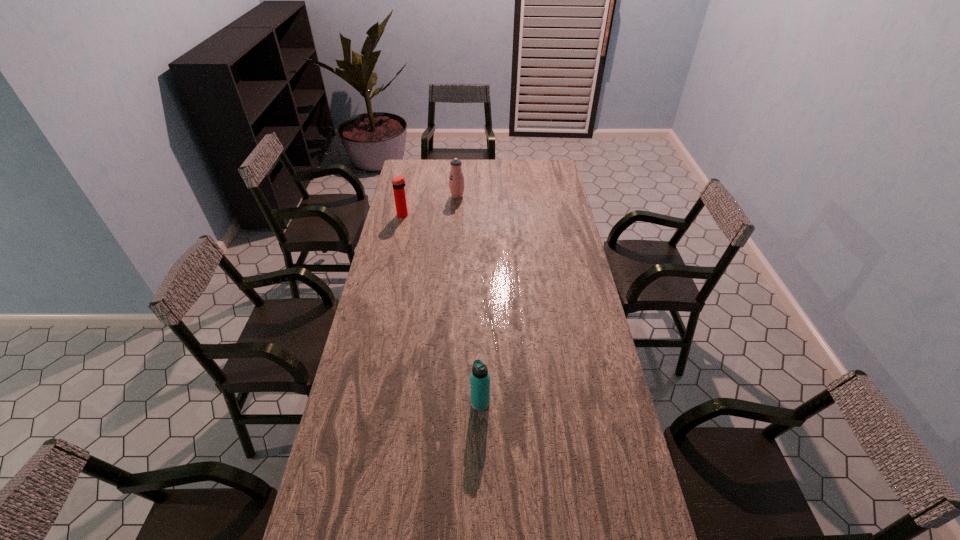
At what (x,y) coordinates should I click in order to perform the action: click on the second object from left to right. Please return your answer as a coordinate pair (x, y). Looking at the image, I should click on (456, 179).

What are the coordinates of `the second thermos bottle from left to right` in the screenshot? It's located at (456, 179).

Identify the location of the second nearest thermos bottle. This screenshot has width=960, height=540. (398, 182).

Where is `the leftmost object`? The height and width of the screenshot is (540, 960). the leftmost object is located at coordinates (398, 182).

You are a GUI agent. You are given a task and a screenshot of the screen. Output one action in this format:
    pyautogui.click(x=<x>, y=<y>)
    Task: Click on the rightmost thermos bottle
    Image resolution: width=960 pixels, height=540 pixels.
    Given the screenshot: What is the action you would take?
    pyautogui.click(x=480, y=378)

Find the location of a particular element. This screenshot has height=540, width=960. the rightmost object is located at coordinates (480, 378).

Locate an element on the screen. This screenshot has height=540, width=960. free space located on the front of the farthest thermos bottle is located at coordinates (454, 248).

The width and height of the screenshot is (960, 540). I want to click on free space located on the front of the leftmost thermos bottle, so click(x=399, y=232).

Locate an element on the screen. The image size is (960, 540). free region located on the back of the nearest object is located at coordinates (480, 309).

This screenshot has width=960, height=540. I want to click on object that is at the left edge, so click(398, 182).